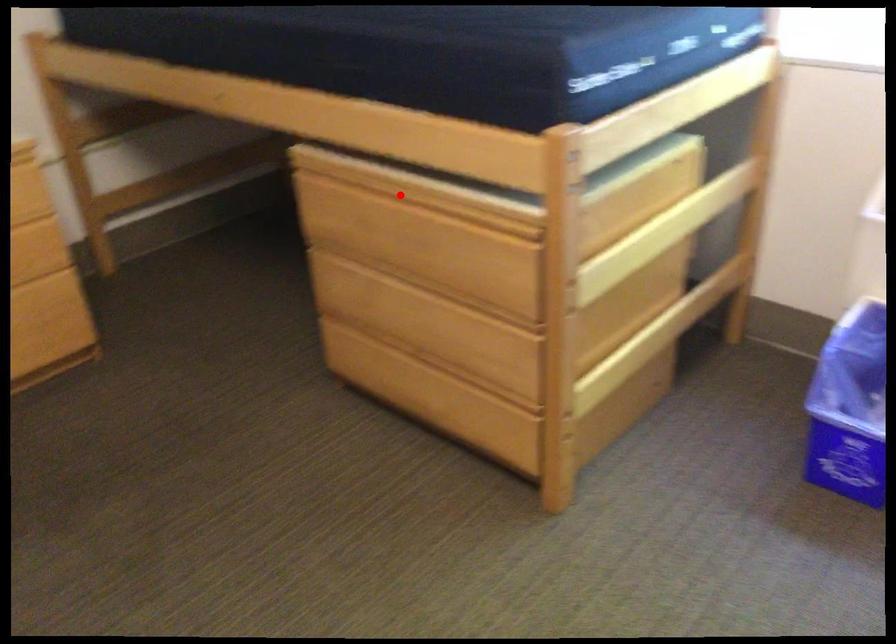
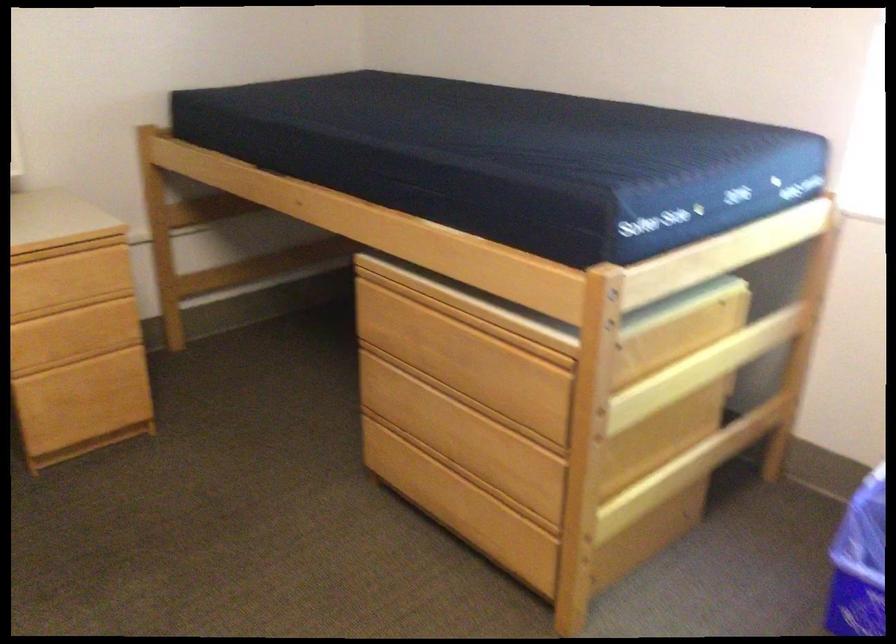
In the second image, find the point that corresponds to the highlighted location in the first image.

(448, 310)